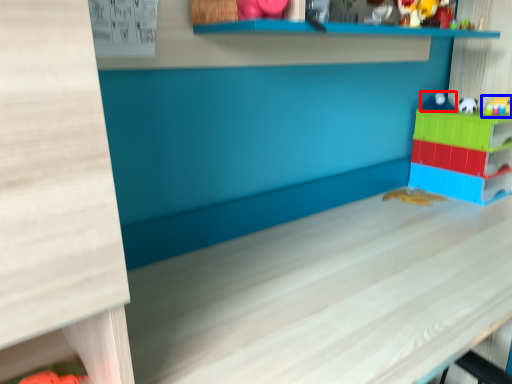
Question: Which point is further to the camera, toy (highlighted by a red box) or toy (highlighted by a blue box)?

Choices:
 (A) toy
 (B) toy

Answer: (A)